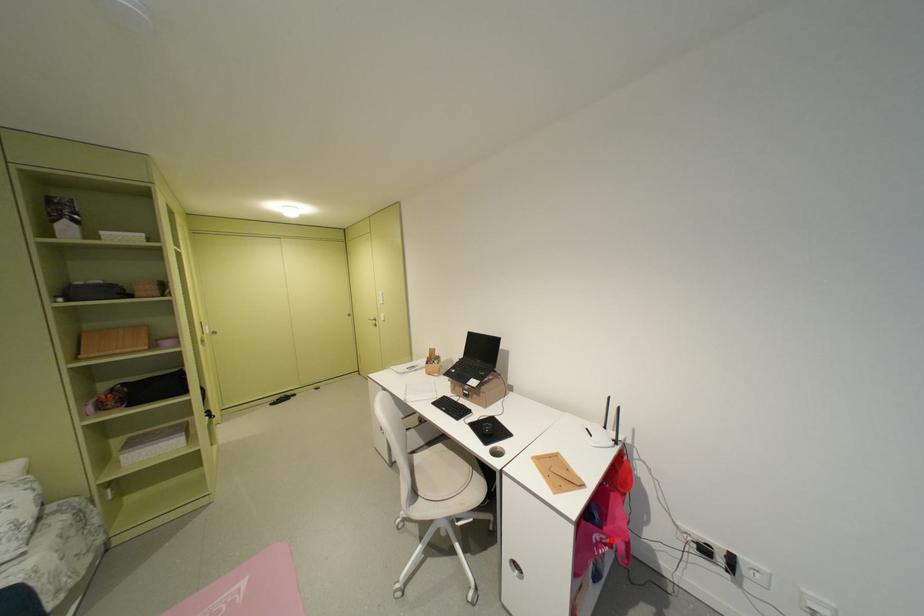
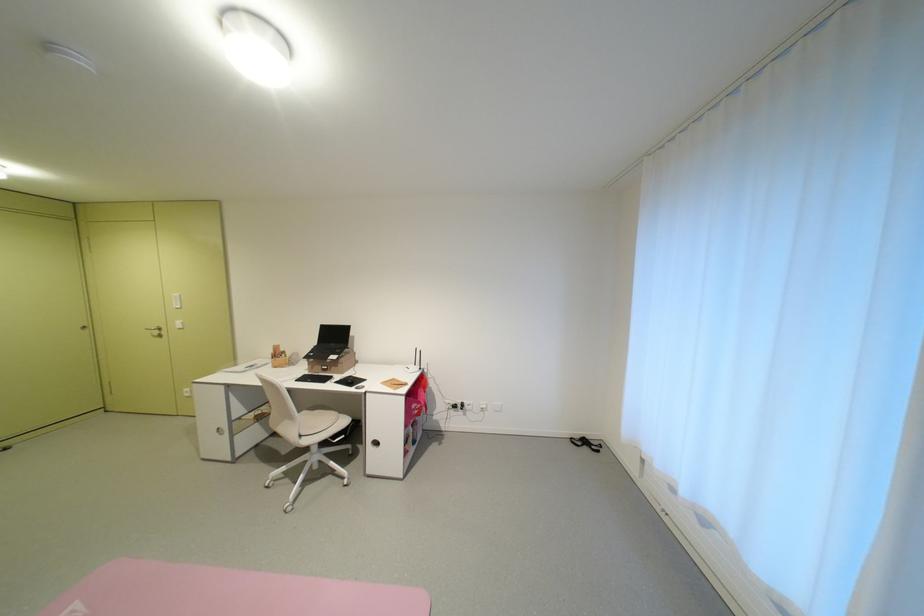
Locate, in the second image, the point that corresponds to the highlighted location in the first image.

(424, 408)